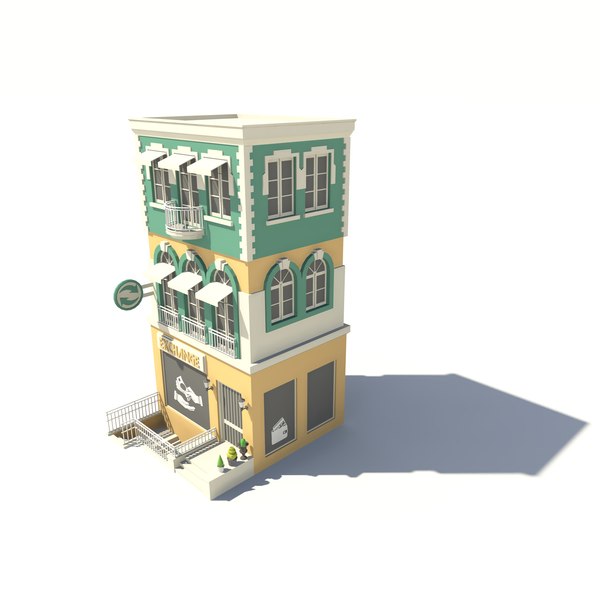
Find the location of a particular element. Image resolution: width=600 pixels, height=600 pixels. lights is located at coordinates (206, 382), (243, 400).